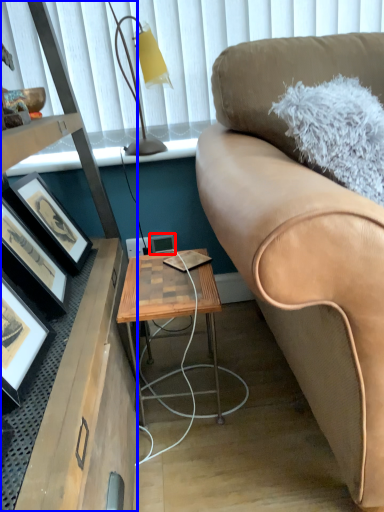
Question: Which point is further to the camera, picture frame (highlighted by a red box) or desk (highlighted by a blue box)?

Choices:
 (A) picture frame
 (B) desk

Answer: (A)